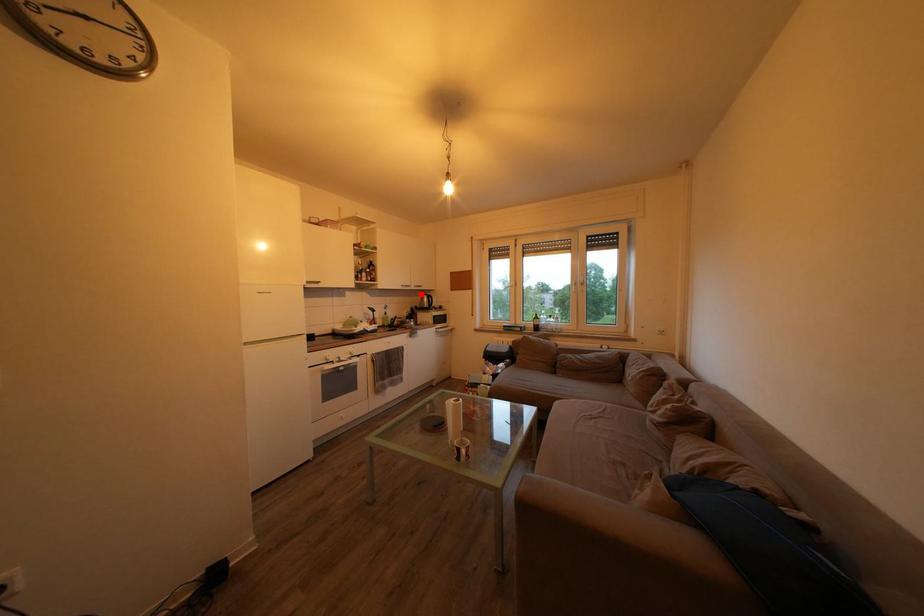
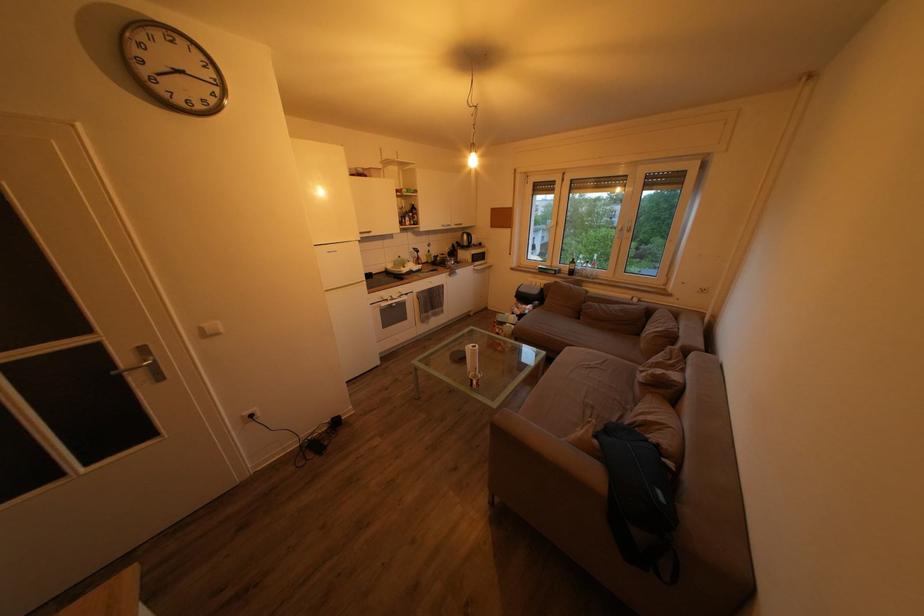
In the second image, find the point that corresponds to the highlighted location in the first image.

(462, 233)